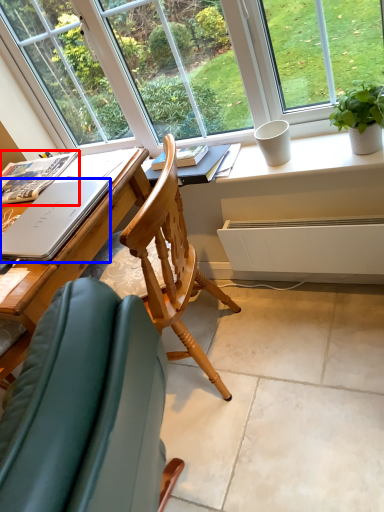
Question: Among these objects, which one is farthest to the camera, book (highlighted by a red box) or laptop (highlighted by a blue box)?

Choices:
 (A) book
 (B) laptop

Answer: (A)